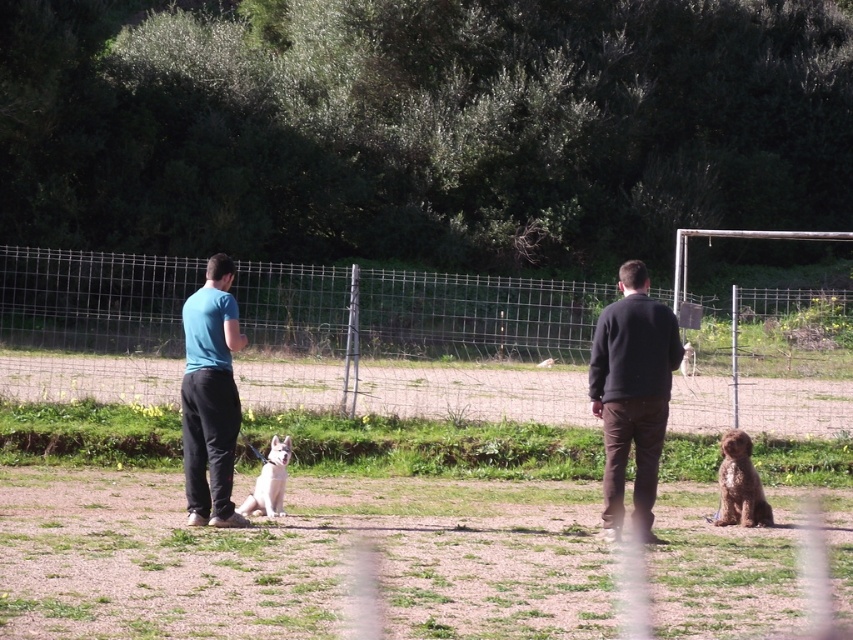
The width and height of the screenshot is (853, 640). What do you see at coordinates (299, 557) in the screenshot?
I see `brown dirt field at center` at bounding box center [299, 557].

Who is higher up, brown dirt field at center or blue cotton shirt at left?

blue cotton shirt at left

You are a GUI agent. You are given a task and a screenshot of the screen. Output one action in this format:
    pyautogui.click(x=<x>, y=<y>)
    Task: Click on the brown dirt field at center
    The width and height of the screenshot is (853, 640).
    Given the screenshot: What is the action you would take?
    pyautogui.click(x=299, y=557)

Is point (175, 355) more distant than point (206, 314)?

That is True.

Can you confirm if metallic wire fence at center is positioned above blue cotton shirt at left?

Indeed, metallic wire fence at center is positioned over blue cotton shirt at left.

Locate an element on the screen. The height and width of the screenshot is (640, 853). metallic wire fence at center is located at coordinates (415, 340).

Image resolution: width=853 pixels, height=640 pixels. In order to click on metallic wire fence at center in this screenshot , I will do `click(415, 340)`.

Based on the photo, does dark brown sweater at right have a larger size compared to white fur dog at center?

Yes.

Who is higher up, dark brown sweater at right or white fur dog at center?

dark brown sweater at right

Find the location of a particular element. The height and width of the screenshot is (640, 853). dark brown sweater at right is located at coordinates (631, 394).

Locate an element on the screen. dark brown sweater at right is located at coordinates (631, 394).